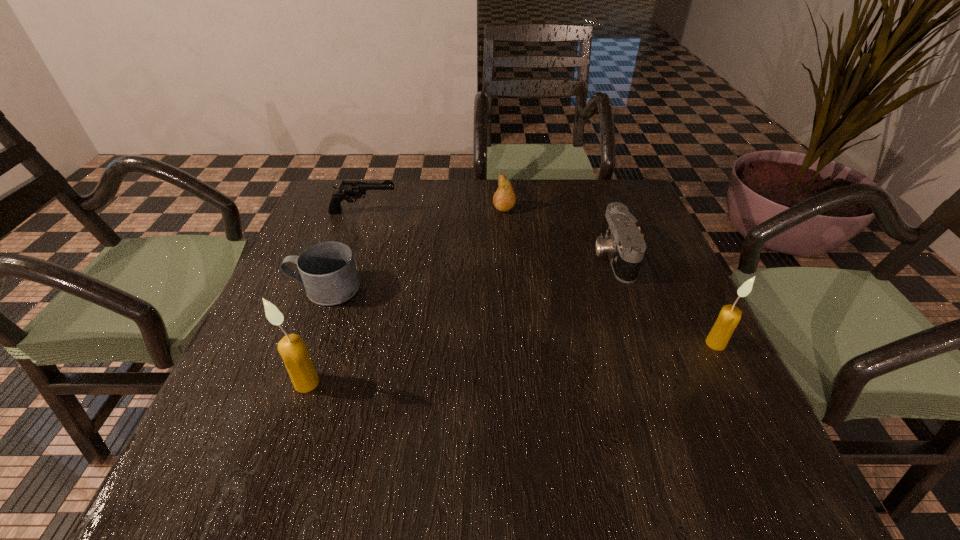
Find the location of `spot to insert another candle for uniform distribution`. spot to insert another candle for uniform distribution is located at coordinates (519, 362).